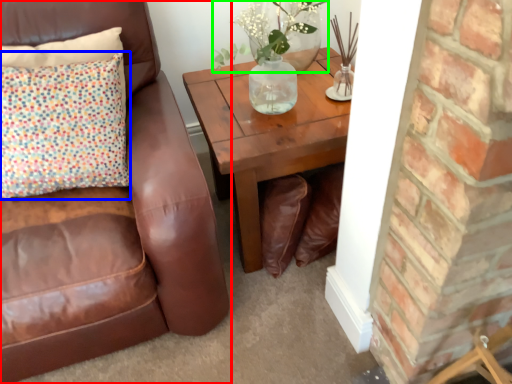
Question: Estimate the real-world distances between objects in this image. Which object is closer to chair (highlighted by a red box), pillow (highlighted by a blue box) or floral arrangement (highlighted by a green box)?

Choices:
 (A) pillow
 (B) floral arrangement

Answer: (A)